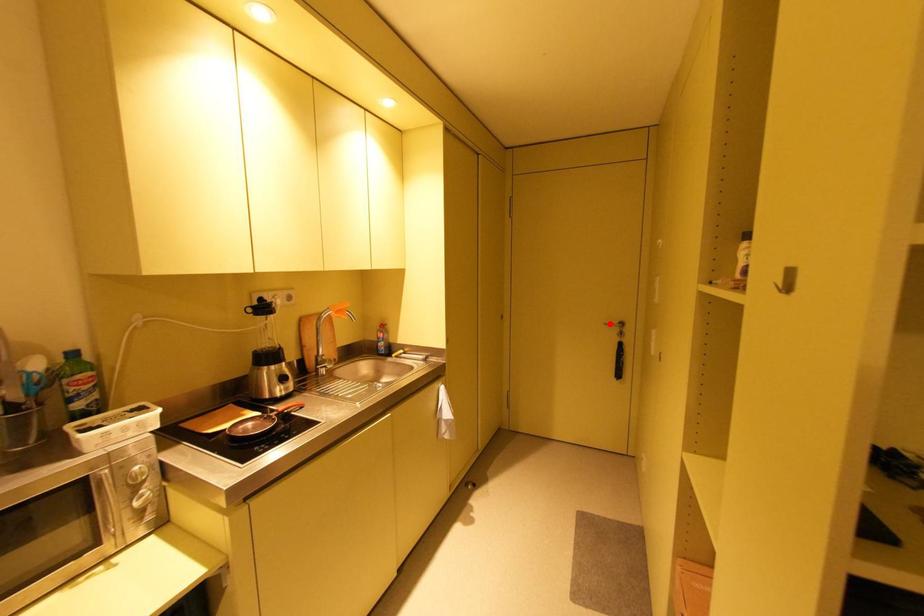
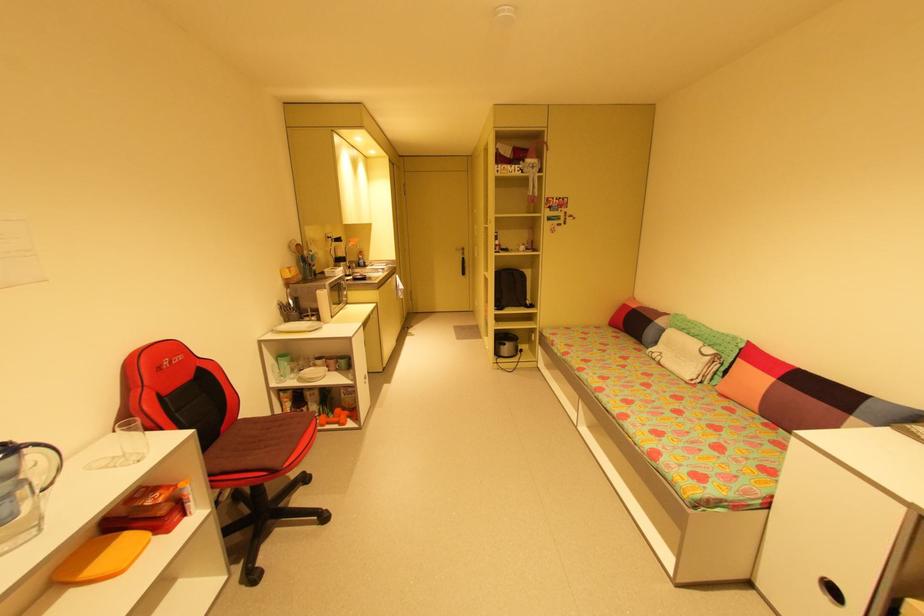
Question: A red point is marked in image1. In image2, is the corresponding 3D point closer to the camera or farther? Reply with the corresponding letter.

Choices:
 (A) The corresponding 3D point is closer.
 (B) The corresponding 3D point is farther.

Answer: (A)